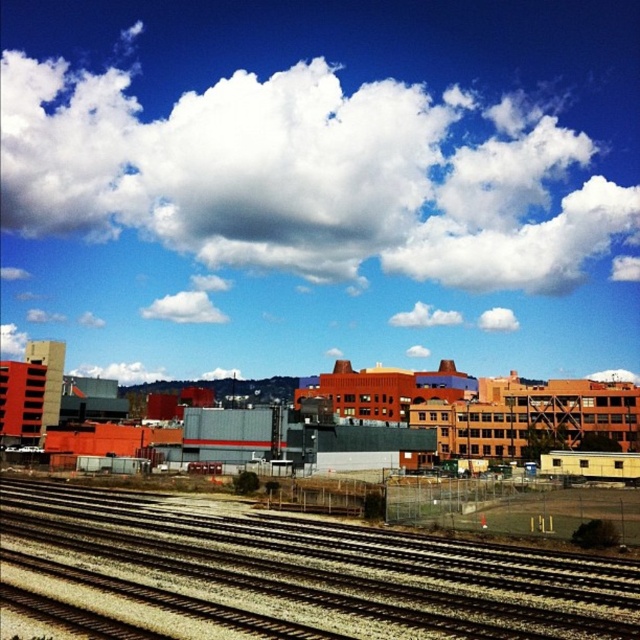
Looking at this image, you are an airplane pilot preparing for takeoff. You notice the white fluffy cloud at upper center and the brown gravel tracks at lower center in your view. Which object is higher in the sky compared to the other?

The white fluffy cloud at upper center is much taller than the brown gravel tracks at lower center, so the white fluffy cloud at upper center is higher in the sky.

You are an airplane pilot preparing for takeoff. You notice the white fluffy cloud at upper center and the brown gravel tracks at lower center in your view. Which object is closer to your current position?

The white fluffy cloud at upper center is closer because the brown gravel tracks at lower center are positioned behind it.

You are a pilot flying an airplane and need to navigate around the point marked at coordinates (307,176). According to the scene description, where exactly is this point located?

The point marked at coordinates (307,176) is located on the white fluffy cloud at upper center.